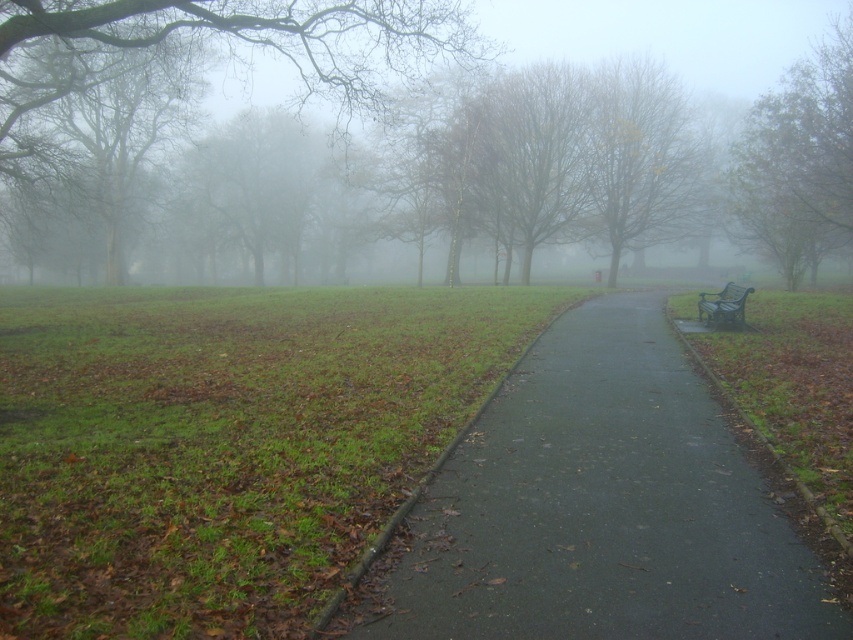
Question: Among these objects, which one is nearest to the camera?

Choices:
 (A) smooth bark tree at upper left
 (B) green painted metal bench at right
 (C) yellow-green foliage at center

Answer: (A)

Question: From the image, what is the correct spatial relationship of green leafy tree at right in relation to green painted metal bench at right?

Choices:
 (A) below
 (B) above

Answer: (B)

Question: Which point appears farthest from the camera in this image?

Choices:
 (A) (630, 115)
 (B) (573, 484)

Answer: (A)

Question: Which of the following is the farthest from the observer?

Choices:
 (A) green painted metal bench at right
 (B) yellow-green foliage at center
 (C) dark asphalt path at center
 (D) smooth bark tree at upper left

Answer: (B)

Question: Is smooth bark tree at upper left smaller than yellow-green foliage at center?

Choices:
 (A) yes
 (B) no

Answer: (B)

Question: Is dark asphalt path at center smaller than yellow-green foliage at center?

Choices:
 (A) no
 (B) yes

Answer: (B)